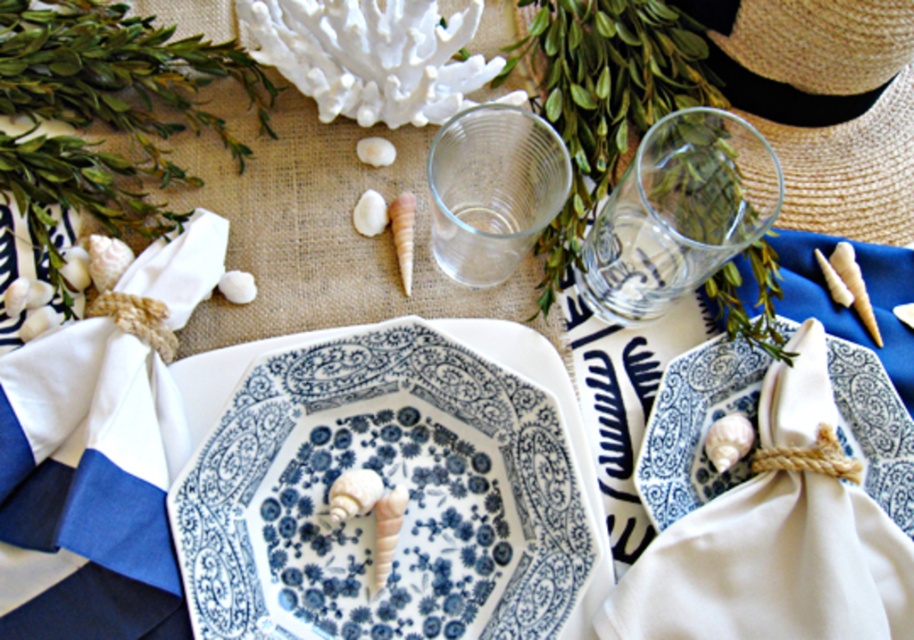
You are setting up a table for a nautical themed dinner. You have a white cotton napkin at left and a clear glass cup at center. Which object is wider?

The white cotton napkin at left is wider than the clear glass cup at center.

You are setting up a table for a nautical themed dinner. You have a white cotton napkin at left and a clear glass at upper right. Where should you place a decorative seashell to ensure it is visible above both items?

Place the decorative seashell above both the white cotton napkin at left and the clear glass at upper right since the white cotton napkin at left is positioned under the clear glass at upper right, allowing the seashell to be visible over them.